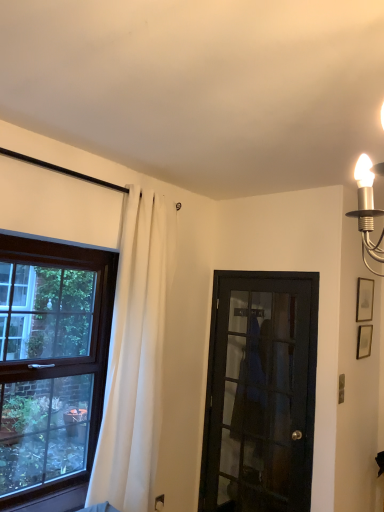
Question: Relative to brown wooden window at left, is matte silver picture frame at upper right, the second picture frame from the top, in front or behind?

Choices:
 (A) behind
 (B) front

Answer: (A)

Question: Considering the positions of matte silver picture frame at upper right, the first picture frame ordered from the bottom, and brown wooden window at left in the image, is matte silver picture frame at upper right, the first picture frame ordered from the bottom, bigger or smaller than brown wooden window at left?

Choices:
 (A) big
 (B) small

Answer: (B)

Question: Which object is the farthest from the brown wooden window at left?

Choices:
 (A) matte silver picture frame at upper right, the second picture frame from the top
 (B) black glass door at center
 (C) white fabric curtain at left
 (D) matte gold picture frame at upper right, positioned as the 2th picture frame in bottom-to-top order

Answer: (A)

Question: Based on their relative distances, which object is farther from the black glass door at center?

Choices:
 (A) matte silver picture frame at upper right, the first picture frame ordered from the bottom
 (B) brown wooden window at left
 (C) white fabric curtain at left
 (D) matte gold picture frame at upper right, marked as the first picture frame in a top-to-bottom arrangement

Answer: (B)